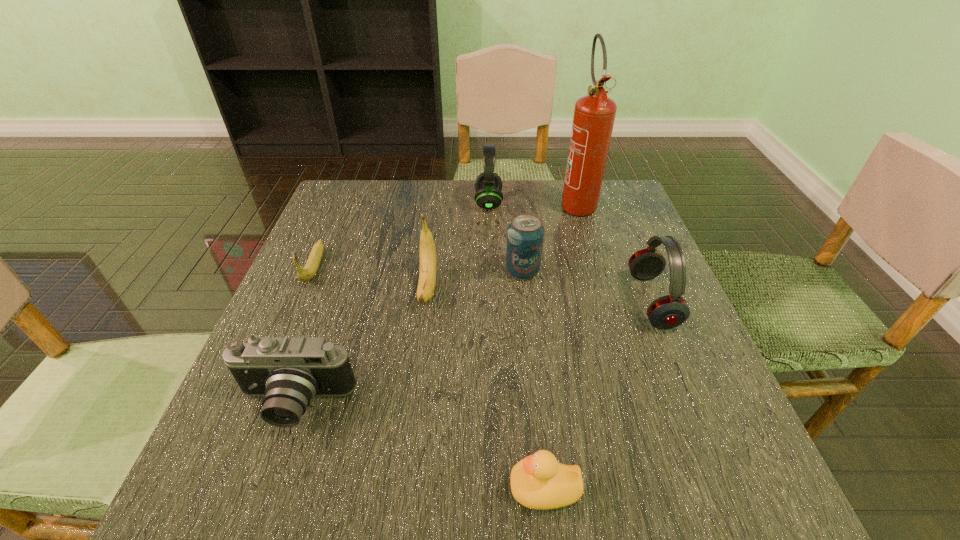
The height and width of the screenshot is (540, 960). In order to click on earphone present at the right edge in this screenshot , I will do `click(670, 311)`.

Locate an element on the screen. The image size is (960, 540). object that is at the far right corner is located at coordinates (594, 114).

This screenshot has height=540, width=960. I want to click on blank space at the far edge of the desktop, so click(x=471, y=215).

At what (x,y) coordinates should I click in order to perform the action: click on free space at the near edge. Please return your answer as a coordinate pair (x, y). The height and width of the screenshot is (540, 960). Looking at the image, I should click on (589, 514).

Where is `vacant region at the left edge of the desktop`? The width and height of the screenshot is (960, 540). vacant region at the left edge of the desktop is located at coordinates (276, 316).

This screenshot has width=960, height=540. Identify the location of free location at the right edge. pyautogui.click(x=609, y=258).

Identify the location of free location at the near left corner of the desktop. (238, 463).

The image size is (960, 540). What are the coordinates of `vacant space at the far right corner of the desktop` in the screenshot? It's located at (617, 192).

In the image, there is a desktop. What are the coordinates of `vacant space at the near right corner` in the screenshot? It's located at (662, 505).

Locate an element on the screen. free space that is in between the duck and the taller banana is located at coordinates (486, 388).